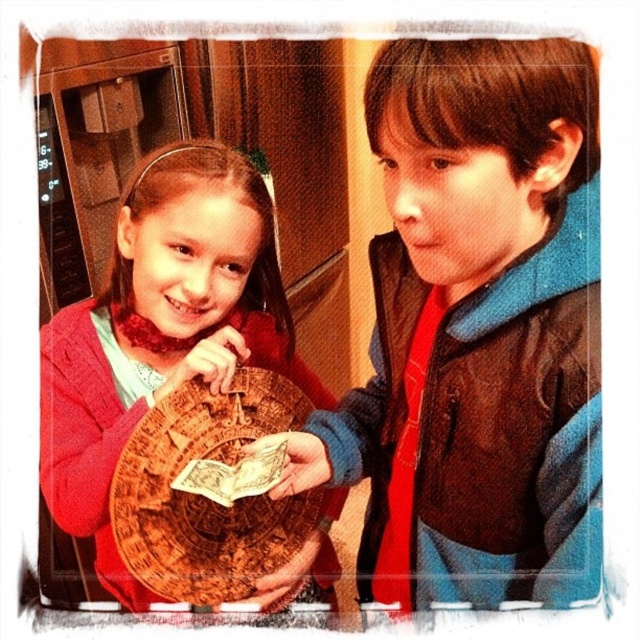
You are a parent observing your children playing with the matte brown wooden puzzle at center and the wooden puzzle piece at center. Which object is taller?

The matte brown wooden puzzle at center is taller than the wooden puzzle piece at center.

You are a photographer trying to capture a photo of the matte brown wooden puzzle at center. To avoid including the blue fleece jacket at upper right in the frame, which direction should you move the camera?

The blue fleece jacket at upper right is positioned on the right side of the matte brown wooden puzzle at center. To exclude it, move the camera to the right so that the matte brown wooden puzzle at center remains in view while the blue fleece jacket at upper right is moved out of frame.